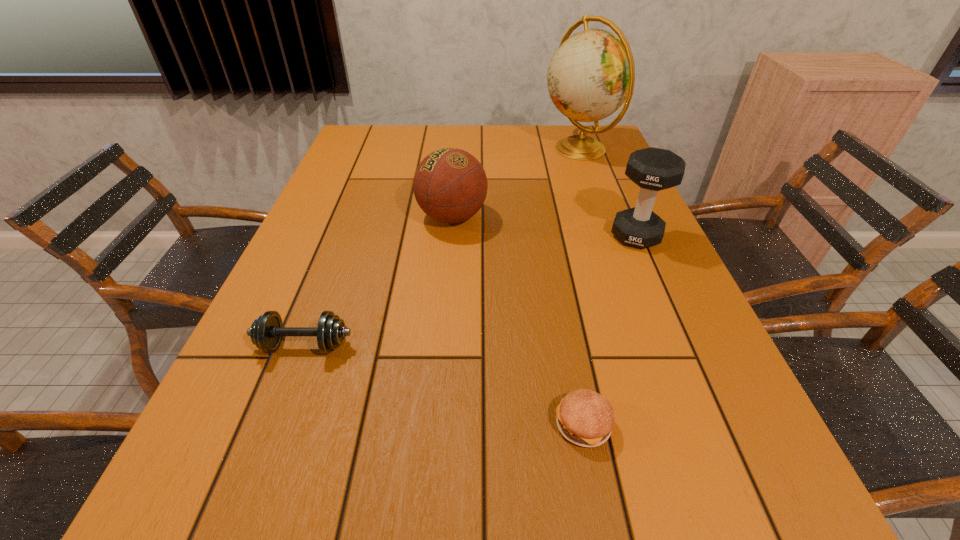
The height and width of the screenshot is (540, 960). In order to click on free spot located on the back of the right dumbbell in this screenshot , I will do `click(613, 184)`.

The image size is (960, 540). I want to click on vacant space positioned 0.380m on the back of the basketball, so click(x=459, y=139).

Where is `vacant area situated on the back of the second shortest object`? The height and width of the screenshot is (540, 960). vacant area situated on the back of the second shortest object is located at coordinates (323, 299).

This screenshot has width=960, height=540. I want to click on vacant point located 0.180m on the left of the hamburger, so click(x=446, y=424).

Identify the location of object situated at the far edge. (592, 73).

The width and height of the screenshot is (960, 540). What are the coordinates of `object situated at the left edge` in the screenshot? It's located at (266, 332).

Find the location of a particular element. globe present at the right edge is located at coordinates (592, 73).

At what (x,y) coordinates should I click in order to perform the action: click on dumbbell situated at the right edge. Please return your answer as a coordinate pair (x, y). Image resolution: width=960 pixels, height=540 pixels. Looking at the image, I should click on (653, 169).

Find the location of a particular element. object present at the far right corner is located at coordinates (592, 73).

Where is `vacant space at the far edge of the desktop`? vacant space at the far edge of the desktop is located at coordinates (471, 143).